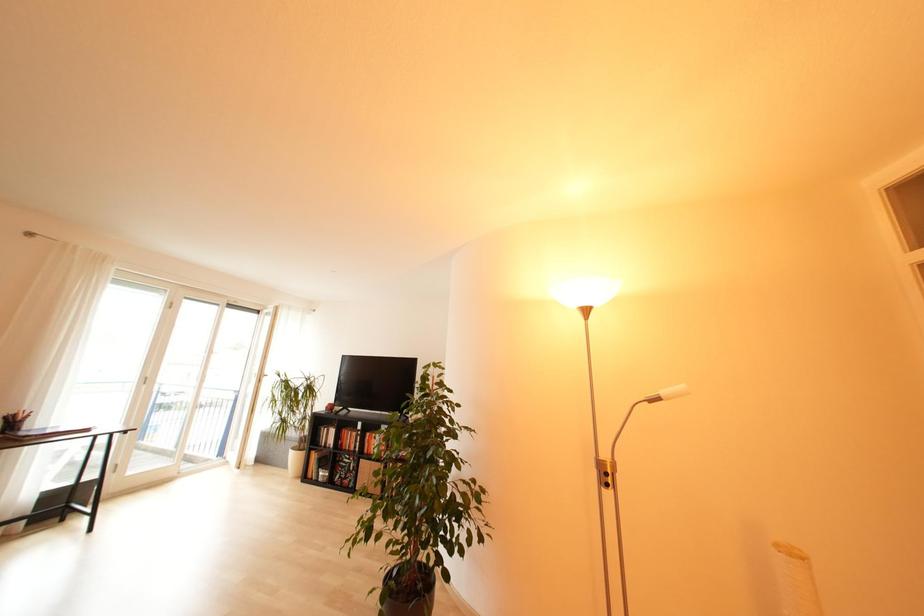
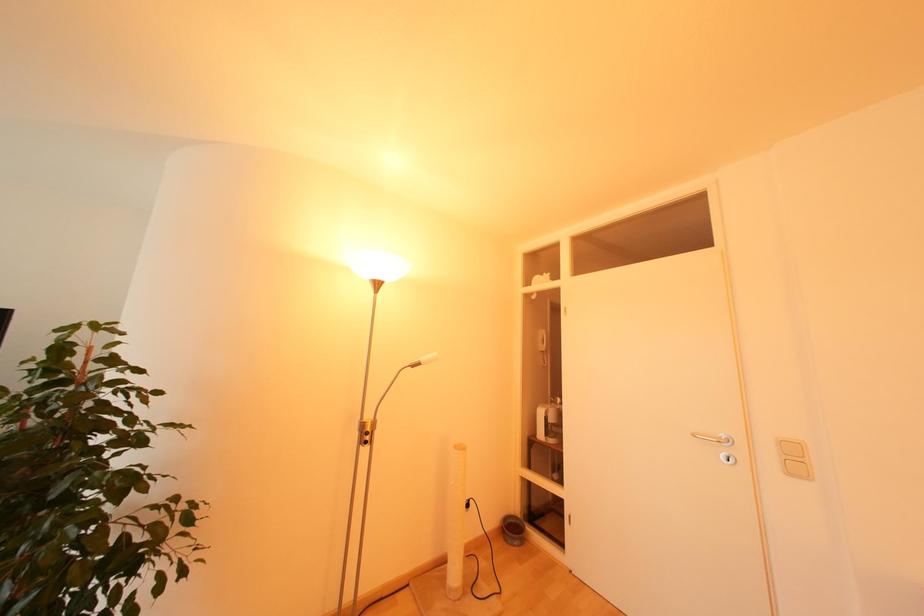
Question: The first image is from the beginning of the video and the second image is from the end. How did the camera likely rotate when shooting the video?

Choices:
 (A) Left
 (B) Right
 (C) Up
 (D) Down

Answer: (B)